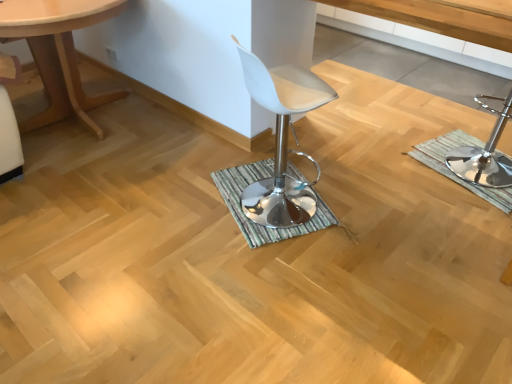
Describe the element at coordinates (58, 52) in the screenshot. I see `light wood table at left` at that location.

In order to face white plastic stool at center, should I rotate leftwards or rightwards?

Rotate right and turn 19.708 degrees.

Where is `white leather stool at center`? The image size is (512, 384). white leather stool at center is located at coordinates (282, 139).

Considering the relative positions of green striped bath mat at right, the second bath mat when ordered from left to right, and light wood table at left in the image provided, is green striped bath mat at right, the second bath mat when ordered from left to right, to the left or to the right of light wood table at left?

green striped bath mat at right, the second bath mat when ordered from left to right, is to the right of light wood table at left.

From the image's perspective, starting from the light wood table at left, which bath mat is the 1st one below? Please provide its 2D coordinates.

[(455, 174)]

From the image's perspective, is green striped bath mat at right, the first bath mat viewed from the right, located above light wood table at left?

No, from the image's perspective, green striped bath mat at right, the first bath mat viewed from the right, is not above light wood table at left.

Which object is further away from the camera, green striped bath mat at right, the first bath mat viewed from the right, or light wood table at left?

green striped bath mat at right, the first bath mat viewed from the right, is further away from the camera.

Considering the relative positions of white leather stool at center and green striped bath mat at right, the second bath mat when ordered from left to right, in the image provided, is white leather stool at center to the right of green striped bath mat at right, the second bath mat when ordered from left to right, from the viewer's perspective?

No, white leather stool at center is not to the right of green striped bath mat at right, the second bath mat when ordered from left to right.

From the picture: Would you say white leather stool at center contains green striped bath mat at right, the first bath mat viewed from the right?

No, green striped bath mat at right, the first bath mat viewed from the right, is located outside of white leather stool at center.

Which is behind, point (284, 65) or point (501, 201)?

The point (501, 201) is more distant.

From the image's perspective, is white leather stool at center positioned above or below green striped bath mat at right, the first bath mat viewed from the right?

Based on their image positions, white leather stool at center is located above green striped bath mat at right, the first bath mat viewed from the right.

From a real-world perspective, which object rests below the other?

In real-world perspective, white leather stool at center is lower.

Is there a large distance between white leather stool at center and white plastic stool at center?

No, there isn't a large distance between white leather stool at center and white plastic stool at center.

Is white leather stool at center positioned beyond the bounds of white plastic stool at center?

Absolutely, white leather stool at center is external to white plastic stool at center.

Considering the positions of objects white leather stool at center and white plastic stool at center in the image provided, who is more to the left, white leather stool at center or white plastic stool at center?

white leather stool at center is more to the left.

From their relative heights in the image, would you say green striped bath mat at right, the first bath mat viewed from the right, is taller or shorter than polished chrome bar stool at right?

green striped bath mat at right, the first bath mat viewed from the right, is shorter than polished chrome bar stool at right.

Between green striped bath mat at right, the second bath mat when ordered from left to right, and polished chrome bar stool at right, which one appears on the left side from the viewer's perspective?

From the viewer's perspective, green striped bath mat at right, the second bath mat when ordered from left to right, appears more on the left side.

Can you confirm if green striped bath mat at right, the second bath mat when ordered from left to right, is thinner than polished chrome bar stool at right?

No.

In the image, is green striped bath mat at right, the second bath mat when ordered from left to right, positioned in front of or behind polished chrome bar stool at right?

In the image, green striped bath mat at right, the second bath mat when ordered from left to right, appears behind polished chrome bar stool at right.

Is light wood table at left facing towards polished chrome bar stool at right?

No, light wood table at left is not turned towards polished chrome bar stool at right.

Considering the relative positions of light wood table at left and polished chrome bar stool at right in the image provided, is light wood table at left to the right of polished chrome bar stool at right from the viewer's perspective?

No, light wood table at left is not to the right of polished chrome bar stool at right.

Find the location of `table in front of the polished chrome bar stool at right`. table in front of the polished chrome bar stool at right is located at coordinates (58, 52).

Is light wood table at left far away from polished chrome bar stool at right?

Yes, light wood table at left is far from polished chrome bar stool at right.

How different are the orientations of green striped bath mat at center, which is counted as the 1th bath mat, starting from the left, and green striped bath mat at right, the first bath mat viewed from the right, in degrees?

The angular difference between green striped bath mat at center, which is counted as the 1th bath mat, starting from the left, and green striped bath mat at right, the first bath mat viewed from the right, is 169 degrees.

Is green striped bath mat at center, which is counted as the 1th bath mat, starting from the left, positioned before green striped bath mat at right, the first bath mat viewed from the right?

That is True.

In the scene shown: How much distance is there between green striped bath mat at center, the second bath mat in the right-to-left sequence, and green striped bath mat at right, the first bath mat viewed from the right?

35.72 inches.

Between green striped bath mat at center, the second bath mat in the right-to-left sequence, and green striped bath mat at right, the first bath mat viewed from the right, which one has larger width?

With larger width is green striped bath mat at right, the first bath mat viewed from the right.

Which object is positioned more to the left, polished chrome bar stool at right or white plastic stool at center?

Positioned to the left is white plastic stool at center.

In the scene shown: From a real-world perspective, is polished chrome bar stool at right positioned under white plastic stool at center based on gravity?

Yes, from a real-world perspective, polished chrome bar stool at right is below white plastic stool at center.

What's the angular difference between polished chrome bar stool at right and white plastic stool at center's facing directions?

polished chrome bar stool at right and white plastic stool at center are facing 167 degrees away from each other.

Find the location of a particular element. the 1st bath mat below the light wood table at left (from the image's perspective) is located at coordinates (455, 174).

The image size is (512, 384). I want to click on bath mat that is the 2nd object directly below the white leather stool at center (from a real-world perspective), so click(455, 174).

Considering their positions, is white plastic stool at center positioned further to white leather stool at center than light wood table at left?

light wood table at left.

Based on their spatial positions, is green striped bath mat at center, which is counted as the 1th bath mat, starting from the left, or white leather stool at center further from light wood table at left?

white leather stool at center is further to light wood table at left.

Considering their positions, is polished chrome bar stool at right positioned closer to light wood table at left than white leather stool at center?

Based on the image, white leather stool at center appears to be nearer to light wood table at left.

From the image, which object appears to be farther from white plastic stool at center, light wood table at left or polished chrome bar stool at right?

The object further to white plastic stool at center is light wood table at left.

Based on their spatial positions, is green striped bath mat at center, which is counted as the 1th bath mat, starting from the left, or white plastic stool at center closer to green striped bath mat at right, the first bath mat viewed from the right?

Among the two, green striped bath mat at center, which is counted as the 1th bath mat, starting from the left, is located nearer to green striped bath mat at right, the first bath mat viewed from the right.

Based on their spatial positions, is polished chrome bar stool at right or green striped bath mat at center, which is counted as the 1th bath mat, starting from the left, further from light wood table at left?

polished chrome bar stool at right lies further to light wood table at left than the other object.

From the image, which object appears to be farther from polished chrome bar stool at right, green striped bath mat at center, the second bath mat in the right-to-left sequence, or light wood table at left?

Based on the image, light wood table at left appears to be further to polished chrome bar stool at right.

Which object lies further to the anchor point green striped bath mat at center, the second bath mat in the right-to-left sequence, white plastic stool at center or white leather stool at center?

The object further to green striped bath mat at center, the second bath mat in the right-to-left sequence, is white plastic stool at center.

I want to click on bath mat situated between green striped bath mat at center, which is counted as the 1th bath mat, starting from the left, and polished chrome bar stool at right from left to right, so click(x=455, y=174).

Image resolution: width=512 pixels, height=384 pixels. I want to click on vanity between green striped bath mat at center, the second bath mat in the right-to-left sequence, and polished chrome bar stool at right from left to right, so click(x=438, y=19).

Find the location of a particular element. This screenshot has height=384, width=512. vanity between green striped bath mat at center, the second bath mat in the right-to-left sequence, and green striped bath mat at right, the second bath mat when ordered from left to right, in the horizontal direction is located at coordinates (438, 19).

Where is `chair between light wood table at left and polished chrome bar stool at right in the horizontal direction`? This screenshot has width=512, height=384. chair between light wood table at left and polished chrome bar stool at right in the horizontal direction is located at coordinates (282, 139).